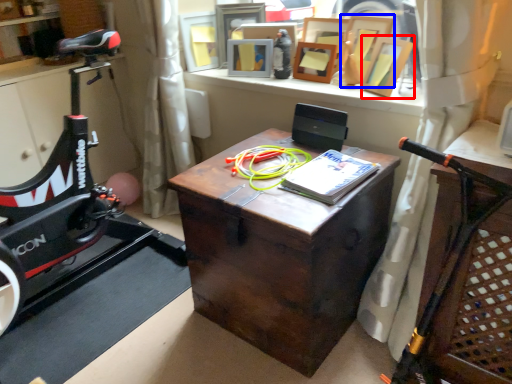
Question: Which point is closer to the camera, picture frame (highlighted by a red box) or picture frame (highlighted by a blue box)?

Choices:
 (A) picture frame
 (B) picture frame

Answer: (A)